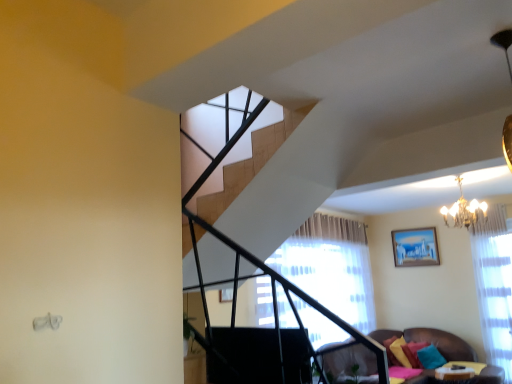
Question: Would you say wooden table at lower right contains velvet yellow pillow at lower right, acting as the first pillow starting from the left?

Choices:
 (A) no
 (B) yes

Answer: (A)

Question: Can we say wooden table at lower right lies outside velvet yellow pillow at lower right, which appears as the third pillow when viewed from the right?

Choices:
 (A) yes
 (B) no

Answer: (A)

Question: Considering the relative sizes of wooden table at lower right and velvet yellow pillow at lower right, acting as the first pillow starting from the left, in the image provided, is wooden table at lower right smaller than velvet yellow pillow at lower right, acting as the first pillow starting from the left,?

Choices:
 (A) no
 (B) yes

Answer: (A)

Question: Is wooden table at lower right oriented away from velvet yellow pillow at lower right, which appears as the third pillow when viewed from the right?

Choices:
 (A) yes
 (B) no

Answer: (B)

Question: Considering the relative sizes of wooden table at lower right and velvet yellow pillow at lower right, acting as the first pillow starting from the left, in the image provided, is wooden table at lower right taller than velvet yellow pillow at lower right, acting as the first pillow starting from the left,?

Choices:
 (A) yes
 (B) no

Answer: (B)

Question: From a real-world perspective, is wooden table at lower right physically below velvet yellow pillow at lower right, which appears as the third pillow when viewed from the right?

Choices:
 (A) yes
 (B) no

Answer: (A)

Question: Is velvet yellow pillow at lower right, which appears as the third pillow when viewed from the right, positioned far away from wooden table at lower right?

Choices:
 (A) no
 (B) yes

Answer: (A)

Question: From a real-world perspective, is velvet yellow pillow at lower right, acting as the first pillow starting from the left, under wooden table at lower right?

Choices:
 (A) no
 (B) yes

Answer: (A)

Question: Is velvet yellow pillow at lower right, acting as the first pillow starting from the left, positioned before wooden table at lower right?

Choices:
 (A) yes
 (B) no

Answer: (B)

Question: Considering the relative sizes of velvet yellow pillow at lower right, acting as the first pillow starting from the left, and wooden table at lower right in the image provided, is velvet yellow pillow at lower right, acting as the first pillow starting from the left, bigger than wooden table at lower right?

Choices:
 (A) no
 (B) yes

Answer: (A)

Question: Considering the relative sizes of velvet yellow pillow at lower right, acting as the first pillow starting from the left, and wooden table at lower right in the image provided, is velvet yellow pillow at lower right, acting as the first pillow starting from the left, taller than wooden table at lower right?

Choices:
 (A) yes
 (B) no

Answer: (A)

Question: Can you confirm if velvet yellow pillow at lower right, acting as the first pillow starting from the left, is shorter than wooden table at lower right?

Choices:
 (A) no
 (B) yes

Answer: (A)

Question: From the image's perspective, is teal fabric pillow at lower right, arranged as the 1th pillow when viewed from the right, beneath matte blue painting at upper right?

Choices:
 (A) no
 (B) yes

Answer: (B)